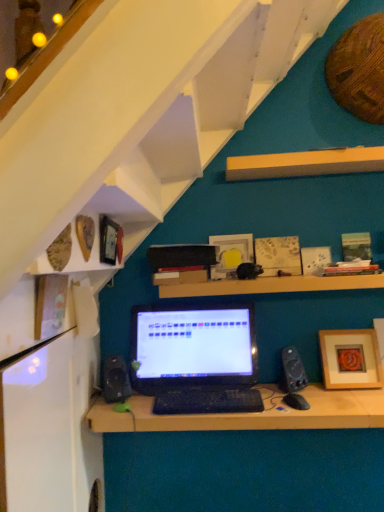
Locate an element on the screen. The height and width of the screenshot is (512, 384). free space above black matte desk at center (from a real-world perspective) is located at coordinates (244, 400).